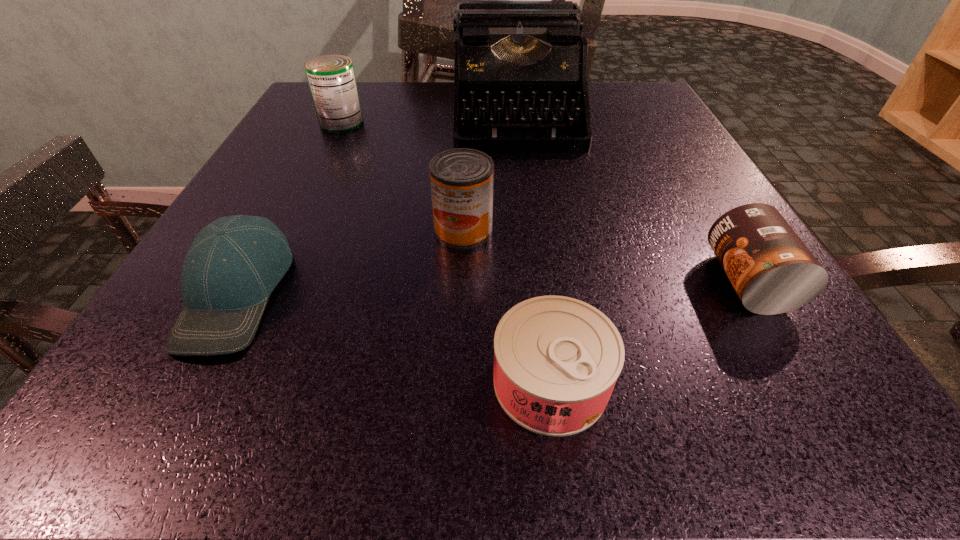
Where is `baseball cap located in the left edge section of the desktop`? The width and height of the screenshot is (960, 540). baseball cap located in the left edge section of the desktop is located at coordinates (234, 263).

Locate an element on the screen. This screenshot has height=540, width=960. object located at the right edge is located at coordinates (772, 271).

What are the coordinates of `object present at the far left corner` in the screenshot? It's located at (331, 78).

This screenshot has width=960, height=540. Find the location of `object positioned at the near left corner`. object positioned at the near left corner is located at coordinates (234, 263).

What are the coordinates of `blank space at the far edge` in the screenshot? It's located at (386, 82).

The image size is (960, 540). What are the coordinates of `vacant position at the near edge of the desktop` in the screenshot? It's located at (695, 420).

In the image, there is a desktop. At what (x,y) coordinates should I click in order to perform the action: click on vacant space at the left edge. Please return your answer as a coordinate pair (x, y). The height and width of the screenshot is (540, 960). Looking at the image, I should click on (266, 339).

In the image, there is a desktop. Find the location of `vacant area at the right edge`. vacant area at the right edge is located at coordinates (741, 338).

Identify the location of vacant space at the far right corner of the desktop. This screenshot has width=960, height=540. (654, 99).

In the image, there is a desktop. Where is `vacant space at the near right corner`? The image size is (960, 540). vacant space at the near right corner is located at coordinates (712, 375).